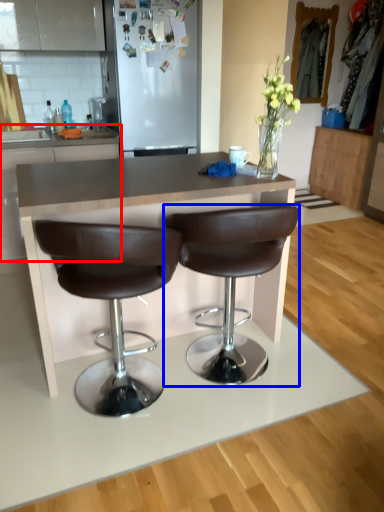
Question: Among these objects, which one is nearest to the camera, cabinetry (highlighted by a red box) or chair (highlighted by a blue box)?

Choices:
 (A) cabinetry
 (B) chair

Answer: (B)